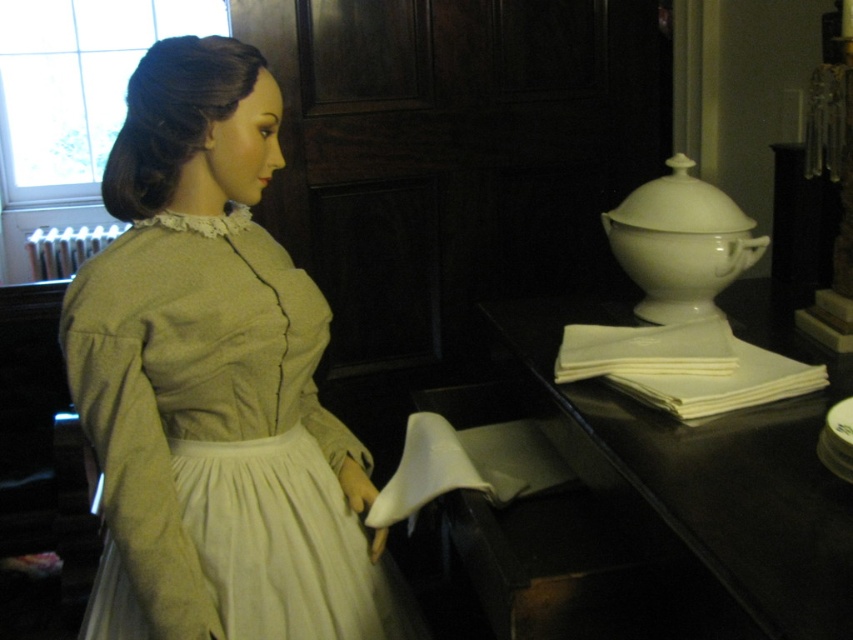
You are an interior designer planning to place a new decorative item at coordinate point 0.600, 0.252. However, you notice the matte green dress at center is already there. Where should you place your item instead?

The matte green dress at center is already at point (213,384), so you should choose a different coordinate that does not overlap with it.

You are standing in a historical exhibit and see the mannequin dressed in period attire. There is a point marked at coordinates (213, 384). Which object does this point correspond to?

The point at coordinates (213, 384) corresponds to the matte green dress at center.